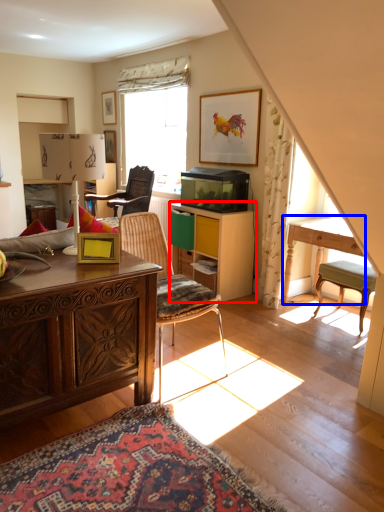
Question: Which object is closer to the camera taking this photo, cabinetry (highlighted by a red box) or table (highlighted by a blue box)?

Choices:
 (A) cabinetry
 (B) table

Answer: (B)